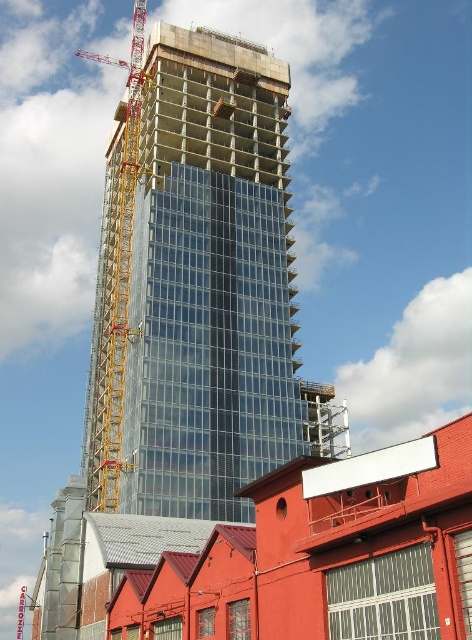
Question: Observing the image, what is the correct spatial positioning of transparent glass building at center in reference to yellow metallic crane at left?

Choices:
 (A) right
 (B) left

Answer: (A)

Question: Does transparent glass building at center appear on the right side of yellow metallic crane at left?

Choices:
 (A) yes
 (B) no

Answer: (A)

Question: Is transparent glass building at center positioned in front of yellow metallic crane at left?

Choices:
 (A) no
 (B) yes

Answer: (B)

Question: Among these points, which one is nearest to the camera?

Choices:
 (A) (128, 282)
 (B) (192, 250)

Answer: (B)

Question: Among these objects, which one is farthest from the camera?

Choices:
 (A) yellow metallic crane at left
 (B) transparent glass building at center

Answer: (A)

Question: Which of the following is the closest to the observer?

Choices:
 (A) (238, 324)
 (B) (112, 380)

Answer: (A)